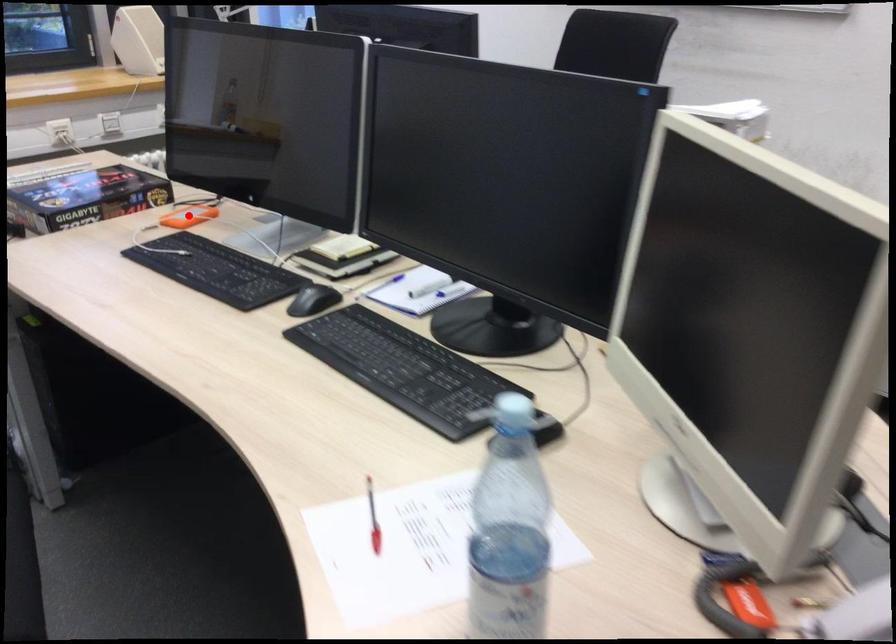
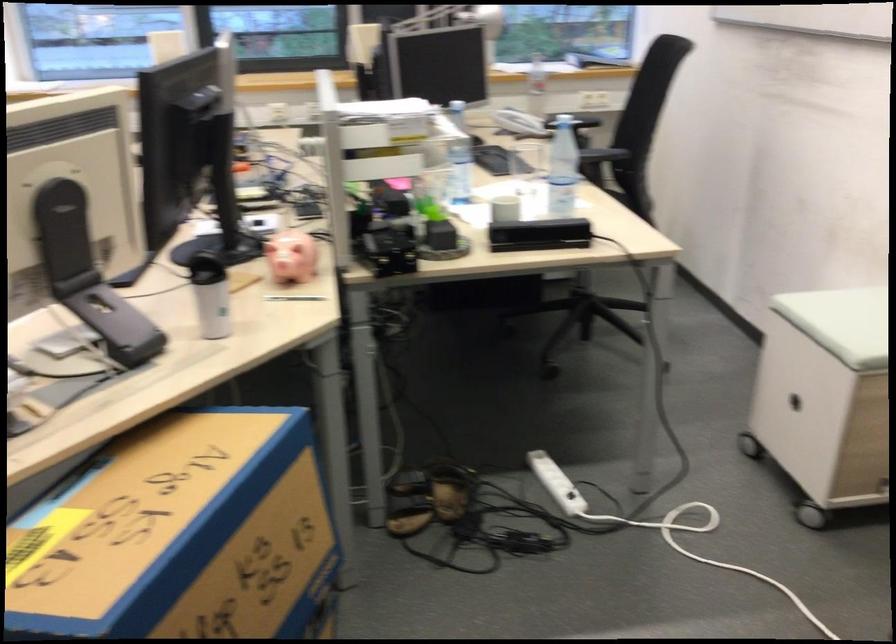
Question: I am providing you with two images of the same scene from different viewpoints. A red point is marked on the first image. At the location where the point appears in image 1, is it still visible in image 2?

Choices:
 (A) Yes
 (B) No

Answer: (B)